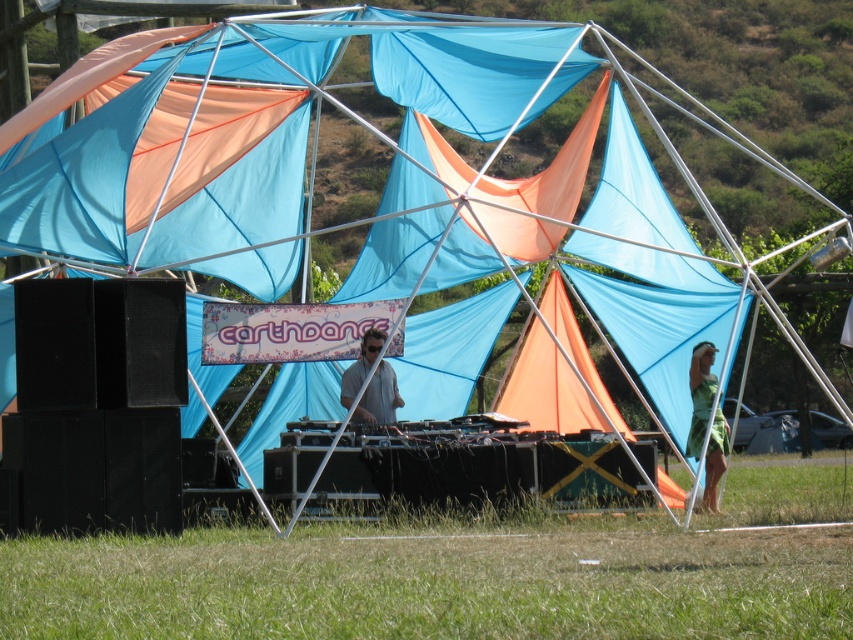
Question: Observing the image, what is the correct spatial positioning of green fabric dress at right in reference to matte gray shirt at center?

Choices:
 (A) right
 (B) left

Answer: (A)

Question: Which point is closer to the camera?

Choices:
 (A) green fabric dress at right
 (B) matte gray shirt at center

Answer: (A)

Question: Which point is farther from the camera taking this photo?

Choices:
 (A) (369, 349)
 (B) (714, 394)

Answer: (B)

Question: Can you confirm if green fabric dress at right is wider than matte gray shirt at center?

Choices:
 (A) yes
 (B) no

Answer: (A)

Question: Does green fabric dress at right appear on the right side of matte gray shirt at center?

Choices:
 (A) no
 (B) yes

Answer: (B)

Question: Which point appears farthest from the camera in this image?

Choices:
 (A) (378, 371)
 (B) (708, 392)

Answer: (B)